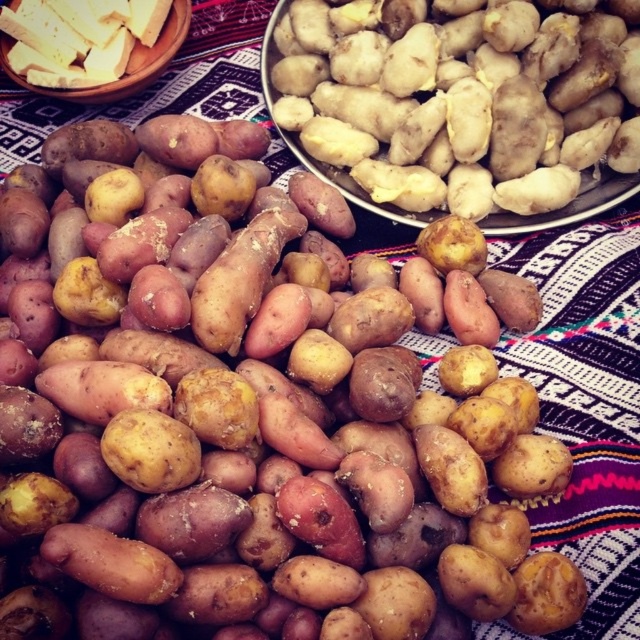
Question: Is smooth beige potato at center in front of yellowish crumbly cheese at upper left?

Choices:
 (A) yes
 (B) no

Answer: (A)

Question: Is smooth beige potato at center above yellowish crumbly cheese at upper left?

Choices:
 (A) yes
 (B) no

Answer: (B)

Question: Which of the following is the closest to the observer?

Choices:
 (A) (24, 40)
 (B) (547, 125)

Answer: (B)

Question: Considering the relative positions of smooth beige potato at center and yellowish crumbly cheese at upper left in the image provided, where is smooth beige potato at center located with respect to yellowish crumbly cheese at upper left?

Choices:
 (A) right
 (B) left

Answer: (A)